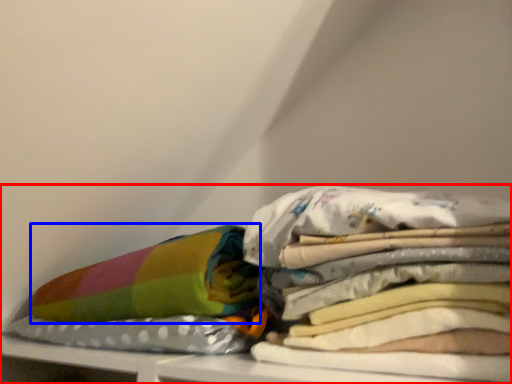
Question: Which of the following is the closest to the observer, furniture (highlighted by a red box) or material (highlighted by a blue box)?

Choices:
 (A) furniture
 (B) material

Answer: (A)